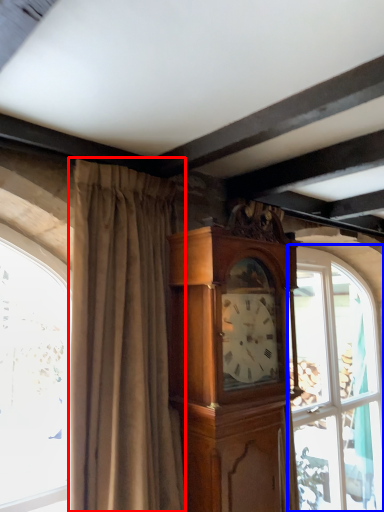
Question: Which object appears farthest to the camera in this image, curtain (highlighted by a red box) or window (highlighted by a blue box)?

Choices:
 (A) curtain
 (B) window

Answer: (B)